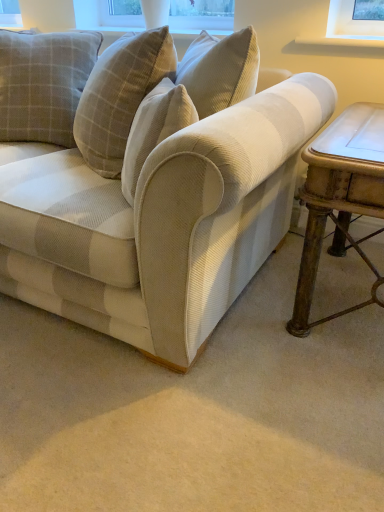
Identify the location of vacant region above rustic wood table at right (from a real-world perspective). This screenshot has width=384, height=512. (358, 123).